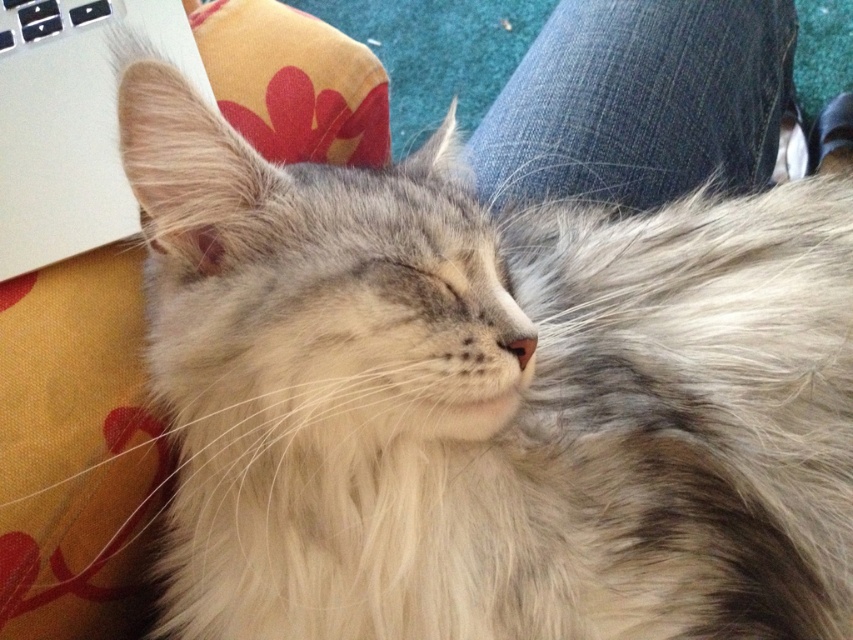
Question: Can you confirm if denim at center is wider than white plastic keyboard at upper left?

Choices:
 (A) no
 (B) yes

Answer: (B)

Question: Estimate the real-world distances between objects in this image. Which object is farther from the silver metallic laptop at upper left?

Choices:
 (A) denim at center
 (B) white plastic keyboard at upper left

Answer: (A)

Question: Is denim at center further to the viewer compared to silver metallic laptop at upper left?

Choices:
 (A) yes
 (B) no

Answer: (A)

Question: Based on their relative distances, which object is nearer to the denim at center?

Choices:
 (A) silver metallic laptop at upper left
 (B) white plastic keyboard at upper left

Answer: (A)

Question: Considering the real-world distances, which object is farthest from the denim at center?

Choices:
 (A) silver metallic laptop at upper left
 (B) white plastic keyboard at upper left

Answer: (B)

Question: Does denim at center come behind white plastic keyboard at upper left?

Choices:
 (A) no
 (B) yes

Answer: (B)